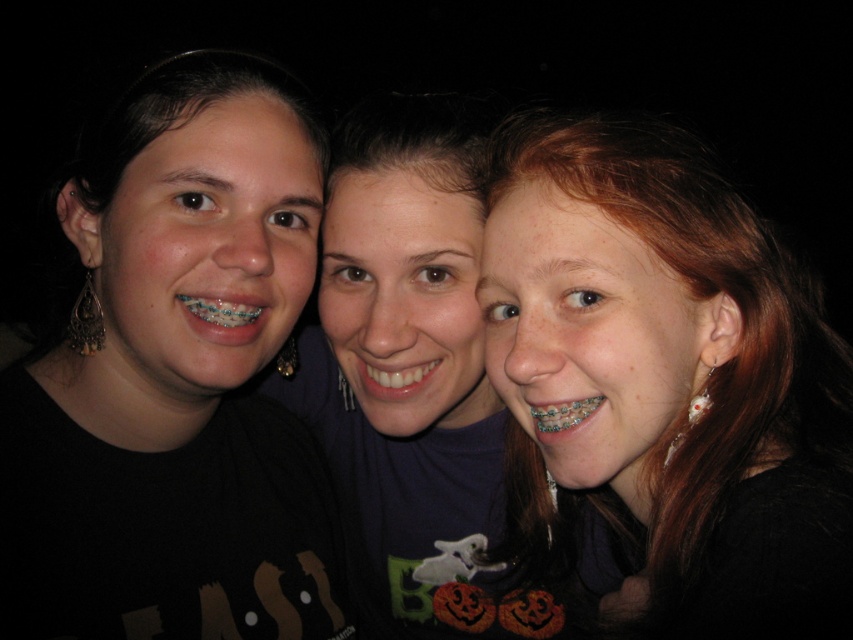
You are a photographer adjusting the lighting for a group photo. You need to ensure that the black matte shirt at left and the metallic braces at center are well lit. Considering their distance apart, can you estimate if the lighting setup will require a single light source or multiple sources to evenly illuminate both objects?

The black matte shirt at left is 6.90 inches from metallic braces at center. To evenly illuminate both objects, a single light source placed centrally between them would suffice since they are relatively close in distance.

You are a photographer trying to frame a shot between the black matte shirt at left and the white glossy teeth at center. Which object should you adjust to ensure both are fully visible in the frame?

The black matte shirt at left might be wider than white glossy teeth at center, so you should adjust the framing to accommodate the width of the black matte shirt at left to ensure both are fully visible.

Looking at the three people in the photo, you notice the white glossy teeth at center and metallic braces at center. Which one is located below the other?

The white glossy teeth at center is positioned under metallic braces at center.